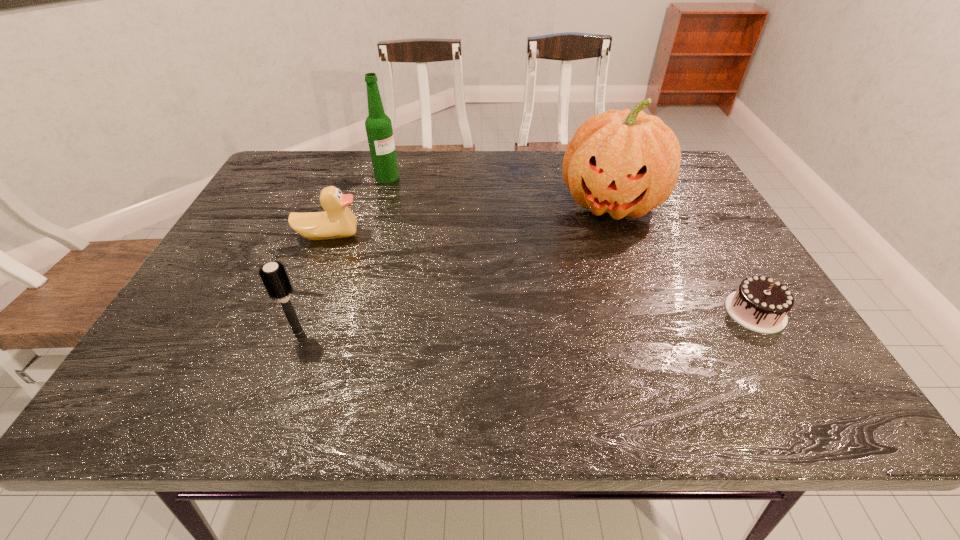
Point out which object is positioned as the nearest to the rightmost object. Please provide its 2D coordinates. Your answer should be formatted as a tuple, i.e. [(x, y)], where the tuple contains the x and y coordinates of a point satisfying the conditions above.

[(626, 163)]

At what (x,y) coordinates should I click in order to perform the action: click on free space that satisfies the following two spatial constraints: 1. on the front side of the beer bottle; 2. on the left side of the rightmost object. Please return your answer as a coordinate pair (x, y). The image size is (960, 540). Looking at the image, I should click on (348, 312).

This screenshot has height=540, width=960. I want to click on free space that satisfies the following two spatial constraints: 1. on the front side of the chocolate cake; 2. on the right side of the second shortest object, so click(299, 312).